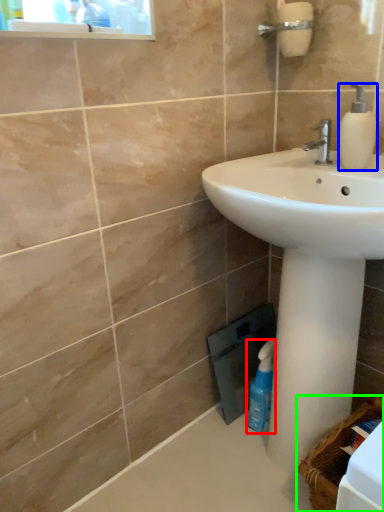
Question: Considering the real-world distances, which object is farthest from cleaning product (highlighted by a red box)? soap dispenser (highlighted by a blue box) or basket (highlighted by a green box)?

Choices:
 (A) soap dispenser
 (B) basket

Answer: (A)